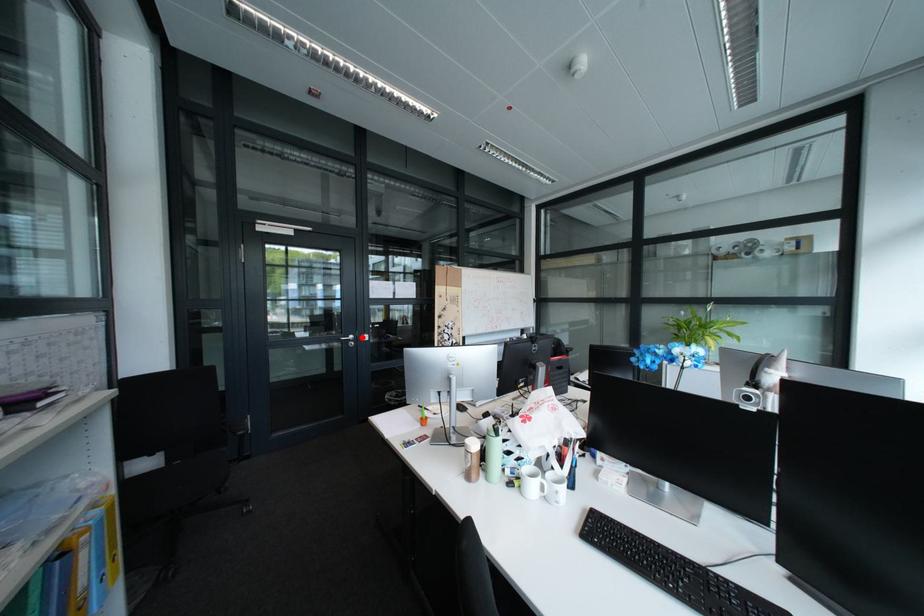
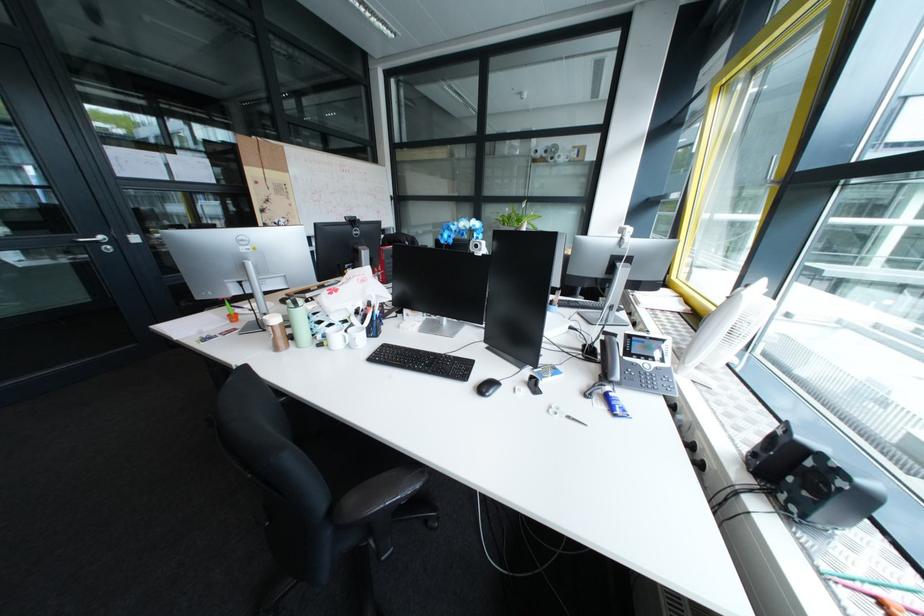
In the second image, find the point that corresponds to the highlighted location in the first image.

(107, 238)